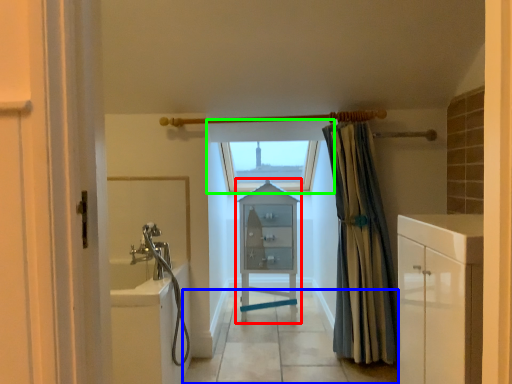
Question: Considering the real-world distances, which object is closest to cabinetry (highlighted by a red box)? path (highlighted by a blue box) or window (highlighted by a green box).

Choices:
 (A) path
 (B) window

Answer: (A)